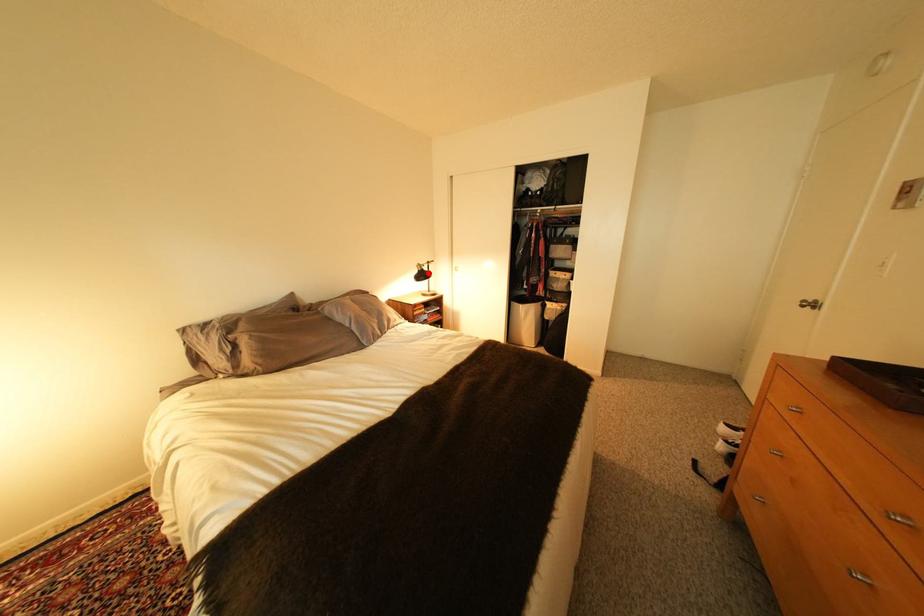
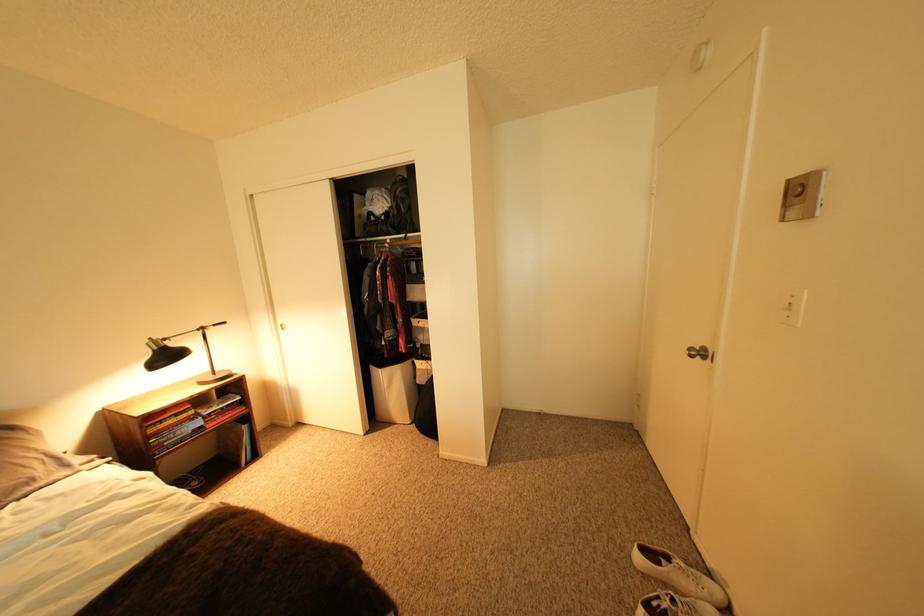
Find the pixel in the second image that matches the highlighted location in the first image.

(165, 353)